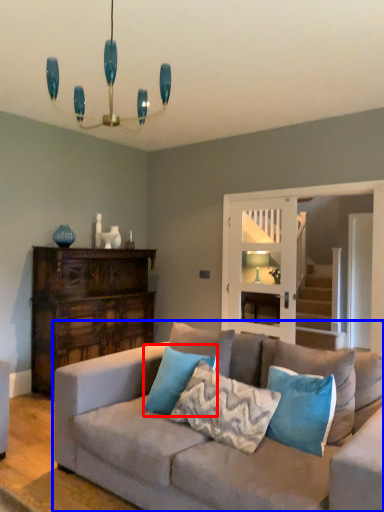
Question: Among these objects, which one is nearest to the camera, pillow (highlighted by a red box) or studio couch (highlighted by a blue box)?

Choices:
 (A) pillow
 (B) studio couch

Answer: (B)